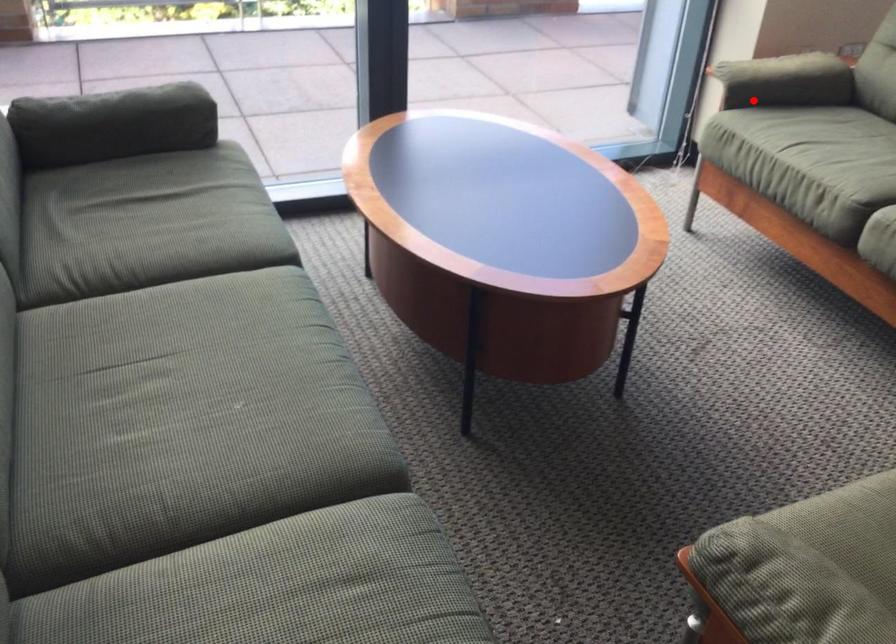
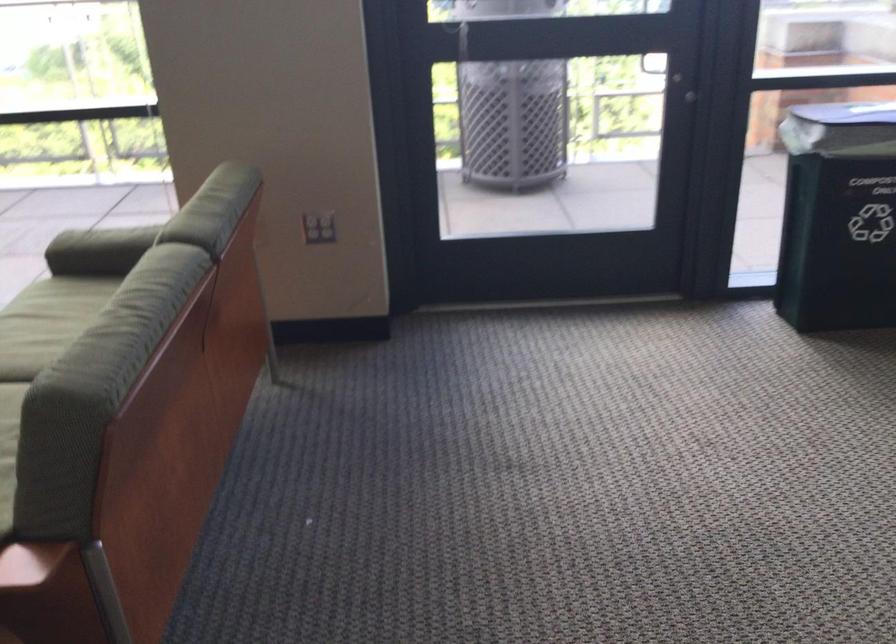
In the second image, find the point that corresponds to the highlighted location in the first image.

(99, 247)